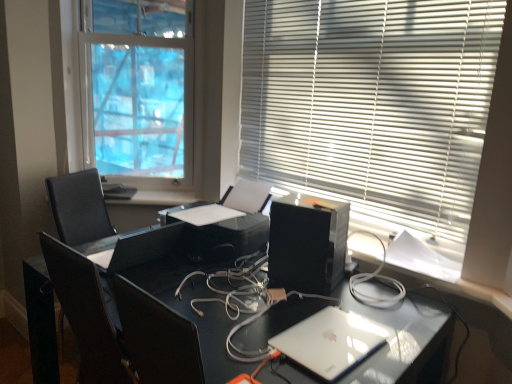
Find the location of `free space to the left of black plastic desktop computer at center`. free space to the left of black plastic desktop computer at center is located at coordinates (240, 280).